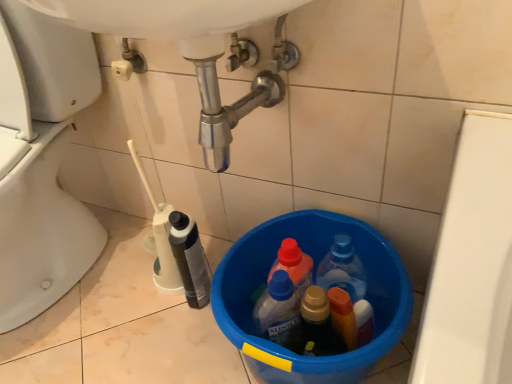
Question: Relative to white glossy toilet at lower left, is white plastic bottle at lower left in front or behind?

Choices:
 (A) front
 (B) behind

Answer: (B)

Question: Considering the positions of white plastic bottle at lower left and white glossy toilet at lower left in the image, is white plastic bottle at lower left bigger or smaller than white glossy toilet at lower left?

Choices:
 (A) big
 (B) small

Answer: (B)

Question: Estimate the real-world distances between objects in this image. Which object is farther from the blue plastic bucket at lower center?

Choices:
 (A) white glossy toilet at lower left
 (B) white plastic bottle at lower left

Answer: (A)

Question: Estimate the real-world distances between objects in this image. Which object is farther from the white glossy toilet at lower left?

Choices:
 (A) white plastic bottle at lower left
 (B) blue plastic bucket at lower center

Answer: (B)